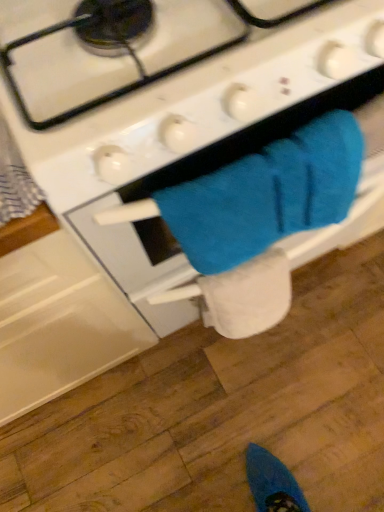
Question: From a real-world perspective, relative to blue fuzzy towel at center, is white matte gas stove at center vertically above or below?

Choices:
 (A) above
 (B) below

Answer: (B)

Question: Looking at their shapes, would you say white matte gas stove at center is wider or thinner than blue fuzzy towel at center?

Choices:
 (A) wide
 (B) thin

Answer: (A)

Question: Estimate the real-world distances between objects in this image. Which object is closer to the white soft toilet paper at lower center?

Choices:
 (A) blue fuzzy towel at center
 (B) white matte gas stove at center

Answer: (A)

Question: Estimate the real-world distances between objects in this image. Which object is closer to the white matte gas stove at center?

Choices:
 (A) white soft toilet paper at lower center
 (B) blue fuzzy towel at center

Answer: (B)